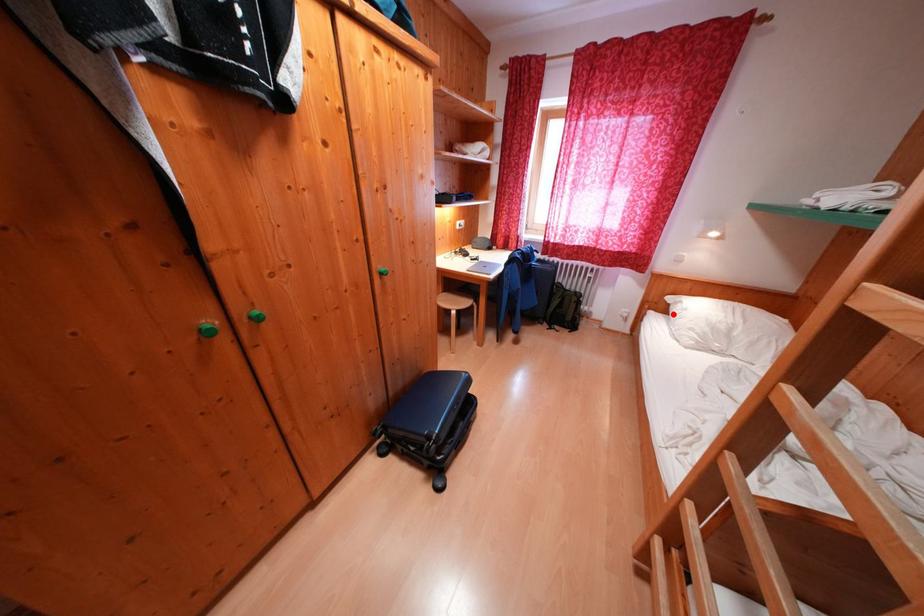
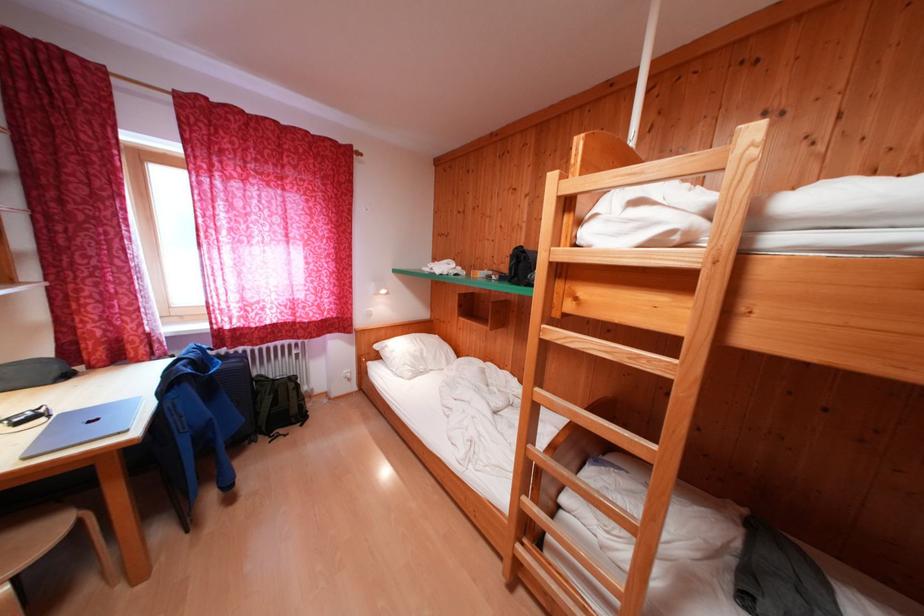
The point at the highlighted location is marked in the first image. Where is the corresponding point in the second image?

(385, 361)